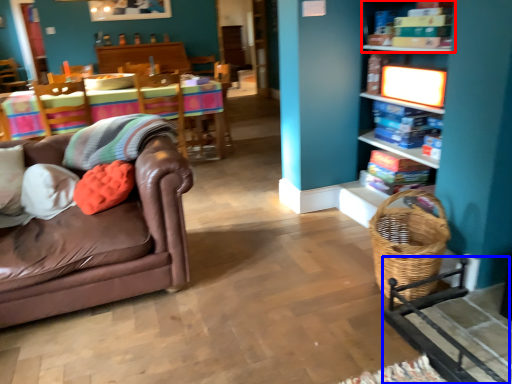
Question: Among these objects, which one is nearest to the camera, shelf (highlighted by a red box) or rocking chair (highlighted by a blue box)?

Choices:
 (A) shelf
 (B) rocking chair

Answer: (B)